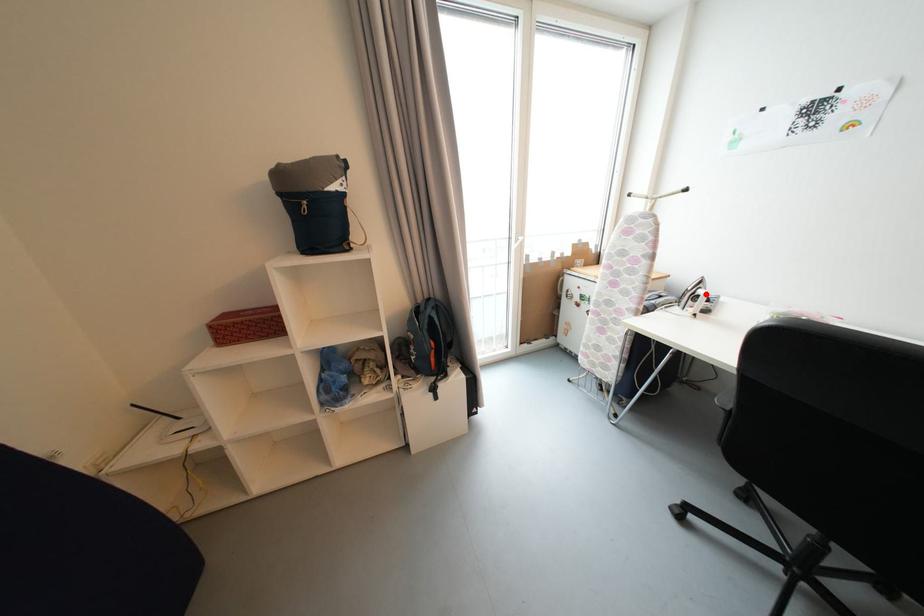
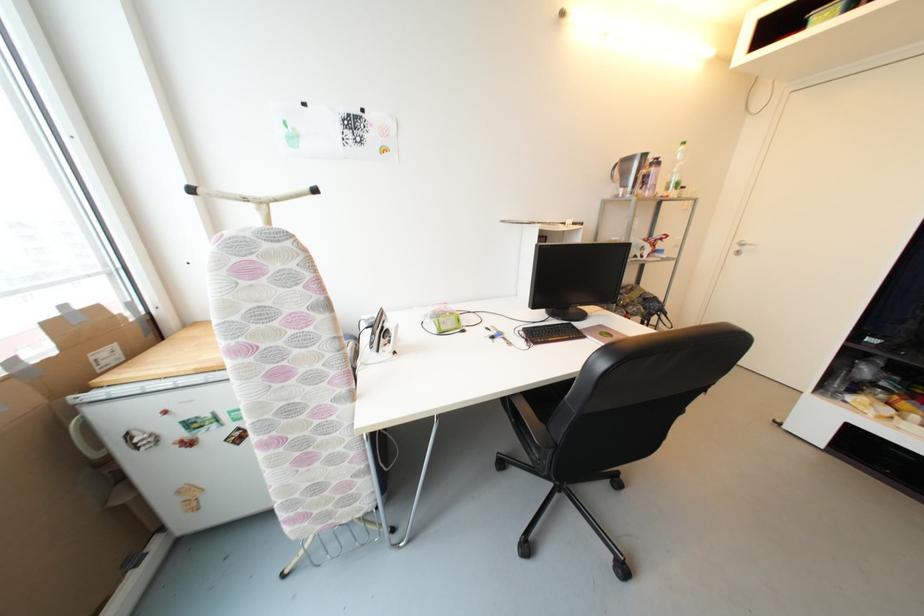
In the second image, find the point that corresponds to the highlighted location in the first image.

(393, 328)